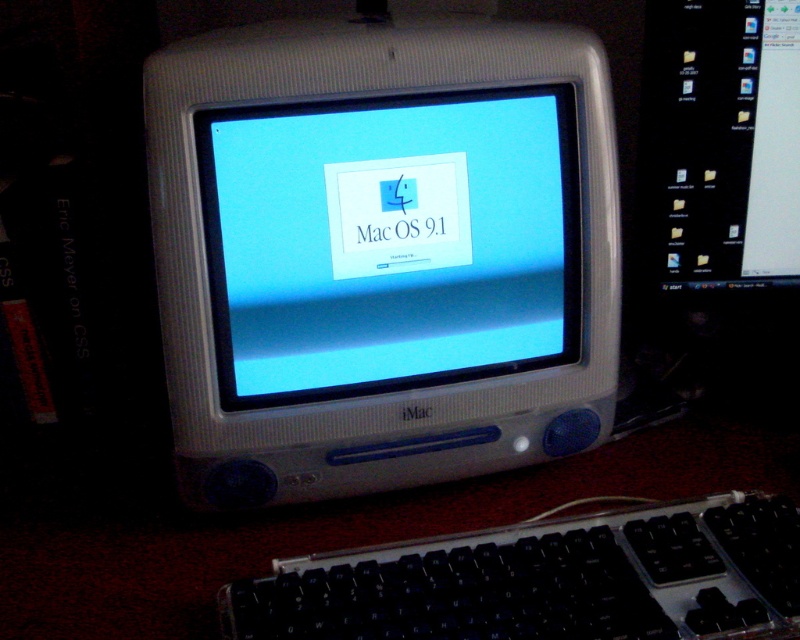
Question: Which point is closer to the camera?

Choices:
 (A) (638, 554)
 (B) (420, 502)
 (C) (352, 164)

Answer: (A)

Question: Does satin silver imac at center have a lesser width compared to black plastic keyboard at lower center?

Choices:
 (A) no
 (B) yes

Answer: (A)

Question: Observing the image, what is the correct spatial positioning of white plastic imac at center in reference to satin silver imac at center?

Choices:
 (A) above
 (B) below

Answer: (A)

Question: Among these points, which one is nearest to the camera?

Choices:
 (A) (274, 456)
 (B) (532, 592)
 (C) (196, 538)

Answer: (B)

Question: Which point appears farthest from the camera in this image?

Choices:
 (A) (410, 608)
 (B) (272, 417)

Answer: (B)

Question: Can you confirm if white plastic imac at center is bigger than black plastic keyboard at lower center?

Choices:
 (A) yes
 (B) no

Answer: (A)